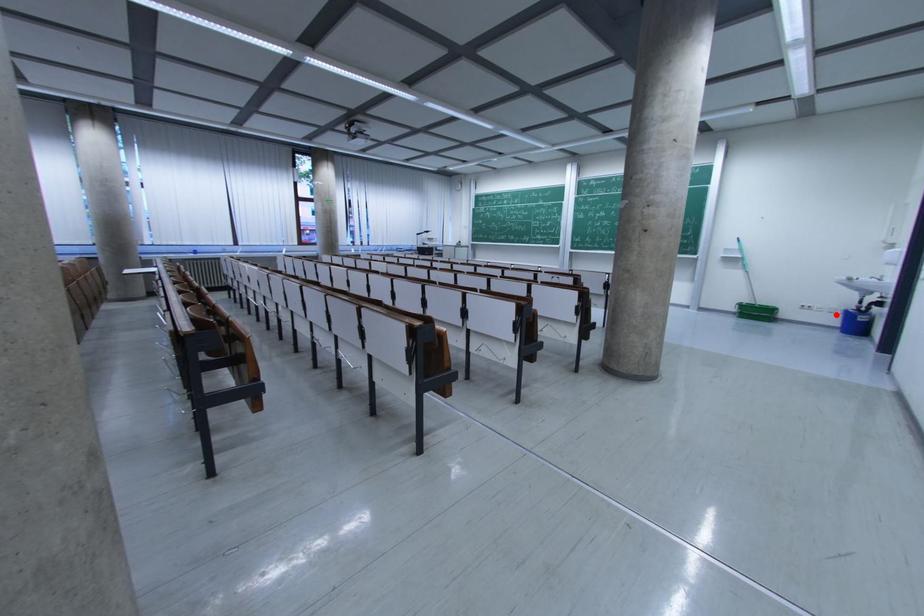
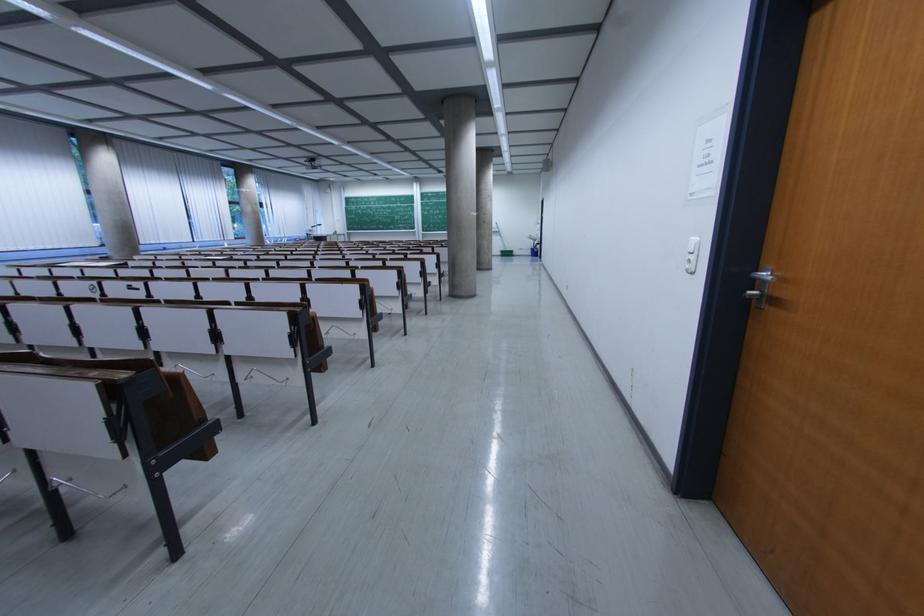
Question: I am providing you with two images of the same scene from different viewpoints. Given a red point in image1, look at the same physical point in image2. Is it:

Choices:
 (A) Closer to the viewpoint
 (B) Farther from the viewpoint

Answer: (A)